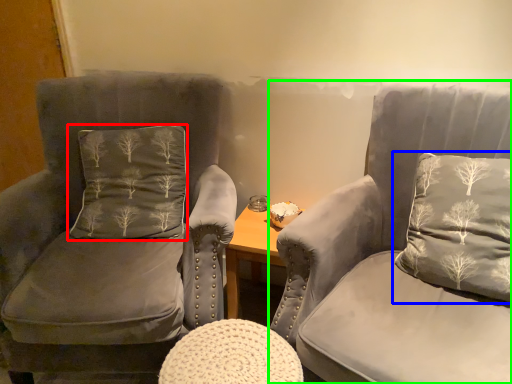
Question: Which object is the farthest from pillow (highlighted by a red box)? Choose among these: pillow (highlighted by a blue box) or chair (highlighted by a green box).

Choices:
 (A) pillow
 (B) chair

Answer: (A)